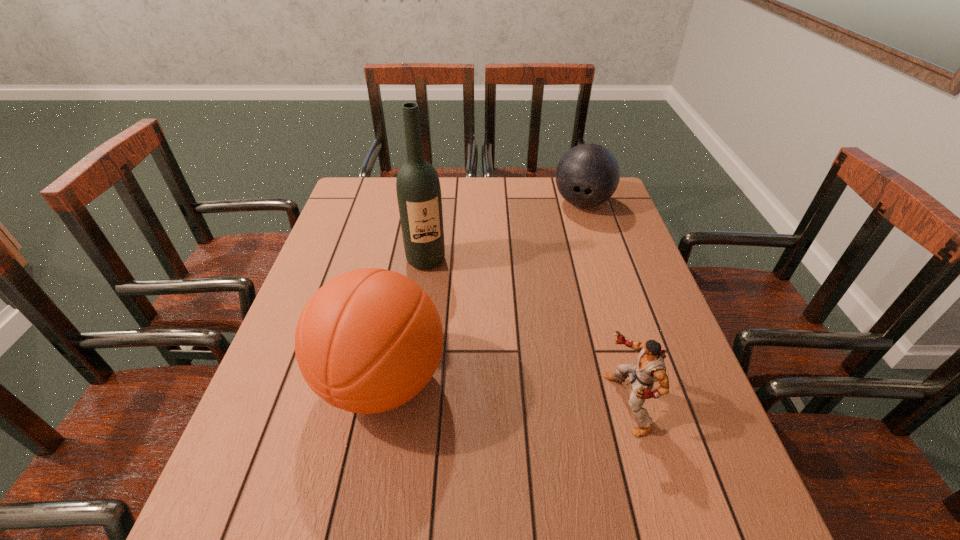
Where is `vacant position located on the grip area of the farthest object`? vacant position located on the grip area of the farthest object is located at coordinates (571, 239).

Identify the location of blank space located on the grip area of the farthest object. (558, 284).

You are a GUI agent. You are given a task and a screenshot of the screen. Output one action in this format:
    pyautogui.click(x=<x>, y=<y>)
    Task: Click on the vacant space positioned 0.200m on the labeled side of the tallest object
    The height and width of the screenshot is (540, 960).
    Given the screenshot: What is the action you would take?
    pyautogui.click(x=449, y=324)

The image size is (960, 540). Identify the location of free spot located on the labeled side of the tallest object. (450, 327).

At what (x,y) coordinates should I click in order to perform the action: click on vacant space located 0.130m on the labeled side of the tallest object. Please return your answer as a coordinate pair (x, y). This screenshot has width=960, height=540. Looking at the image, I should click on (443, 304).

Find the location of a particular element. object positioned at the far edge is located at coordinates (587, 175).

You are a GUI agent. You are given a task and a screenshot of the screen. Output one action in this format:
    pyautogui.click(x=<x>, y=<y>)
    Task: Click on the basketball present at the near edge
    This screenshot has height=540, width=960.
    Given the screenshot: What is the action you would take?
    pyautogui.click(x=369, y=340)

At what (x,y) coordinates should I click in order to perform the action: click on puncher present at the near edge. Please return your answer as a coordinate pair (x, y). This screenshot has height=540, width=960. Looking at the image, I should click on (650, 368).

The image size is (960, 540). What are the coordinates of `object that is at the left edge` in the screenshot? It's located at (369, 340).

This screenshot has height=540, width=960. I want to click on puncher situated at the right edge, so click(650, 368).